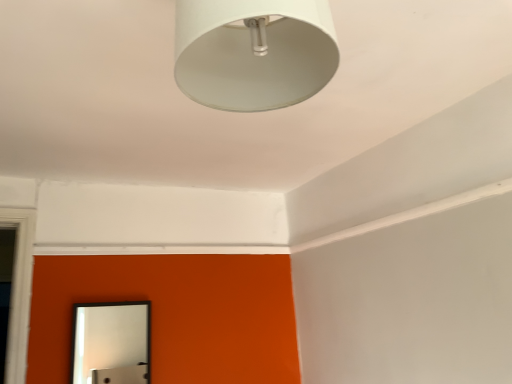
Describe the element at coordinates (254, 52) in the screenshot. I see `white matte lampshade at upper center` at that location.

Where is `white matte lampshade at upper center`? This screenshot has width=512, height=384. white matte lampshade at upper center is located at coordinates (254, 52).

I want to click on white matte lampshade at upper center, so click(x=254, y=52).